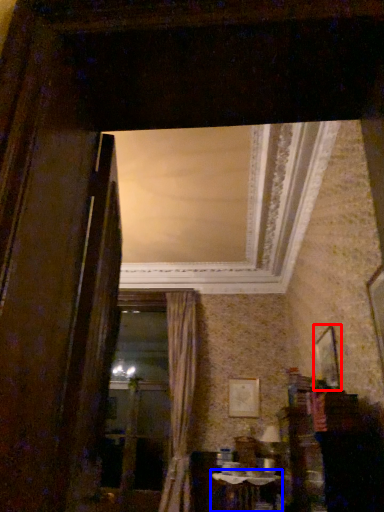
Question: Which of the following is the closest to the observer, picture frame (highlighted by a red box) or table (highlighted by a blue box)?

Choices:
 (A) picture frame
 (B) table

Answer: (A)